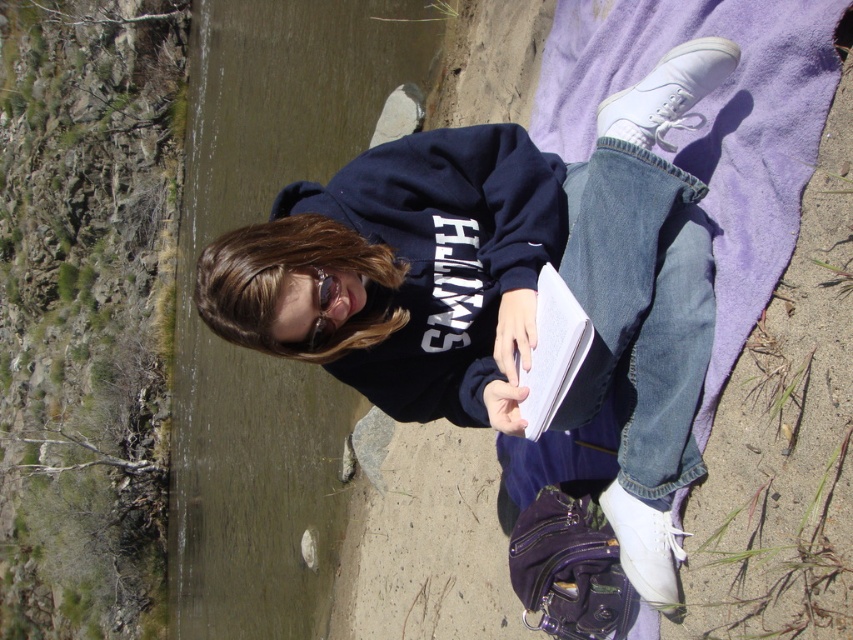
Which is behind, point (322, 332) or point (225, 125)?

The point (225, 125) is more distant.

Is matte black hoodie at center positioned before clear water at river left?

Yes, matte black hoodie at center is in front of clear water at river left.

Which is behind, point (431, 284) or point (265, 477)?

Point (265, 477)

Image resolution: width=853 pixels, height=640 pixels. I want to click on matte black hoodie at center, so click(503, 284).

Is point (645, 209) positioned behind point (555, 362)?

Yes, it is.

Measure the distance between matte black hoodie at center and black paper book at center.

matte black hoodie at center is 11.76 inches away from black paper book at center.

Locate an element on the screen. The height and width of the screenshot is (640, 853). matte black hoodie at center is located at coordinates (503, 284).

Identify the location of matte black hoodie at center. (503, 284).

Is matte black hoodie at center bigger than rugged rock cliff at left?

No, matte black hoodie at center is not bigger than rugged rock cliff at left.

I want to click on matte black hoodie at center, so click(x=503, y=284).